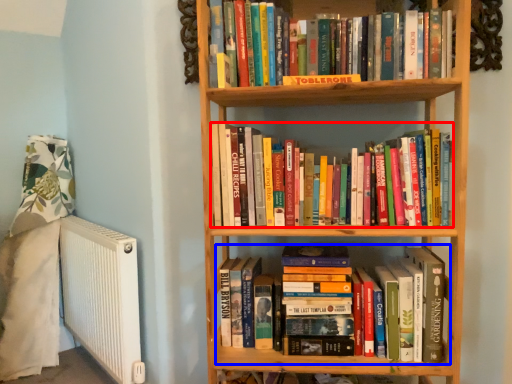
Question: Which object is closer to the camera taking this photo, book (highlighted by a red box) or book (highlighted by a blue box)?

Choices:
 (A) book
 (B) book

Answer: (A)